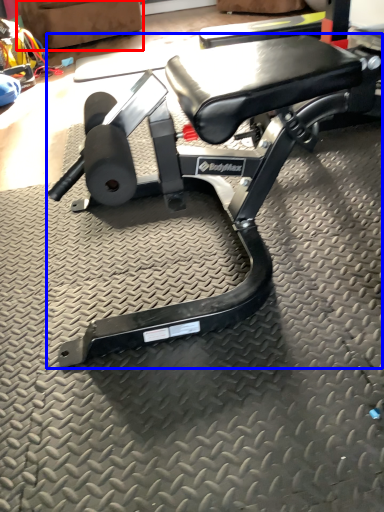
Question: Which object is further to the camera taking this photo, swivel chair (highlighted by a red box) or bench (highlighted by a blue box)?

Choices:
 (A) swivel chair
 (B) bench

Answer: (A)